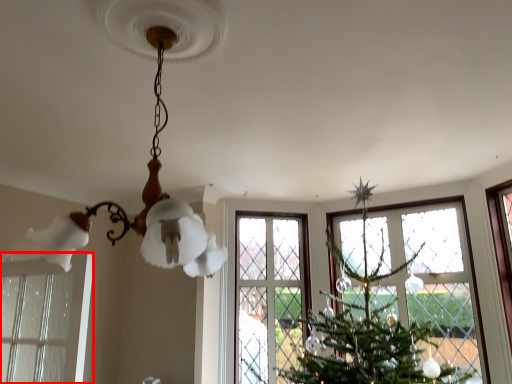
Question: Observing the image, what is the correct spatial positioning of window (annotated by the red box) in reference to lamp?

Choices:
 (A) left
 (B) right

Answer: (A)